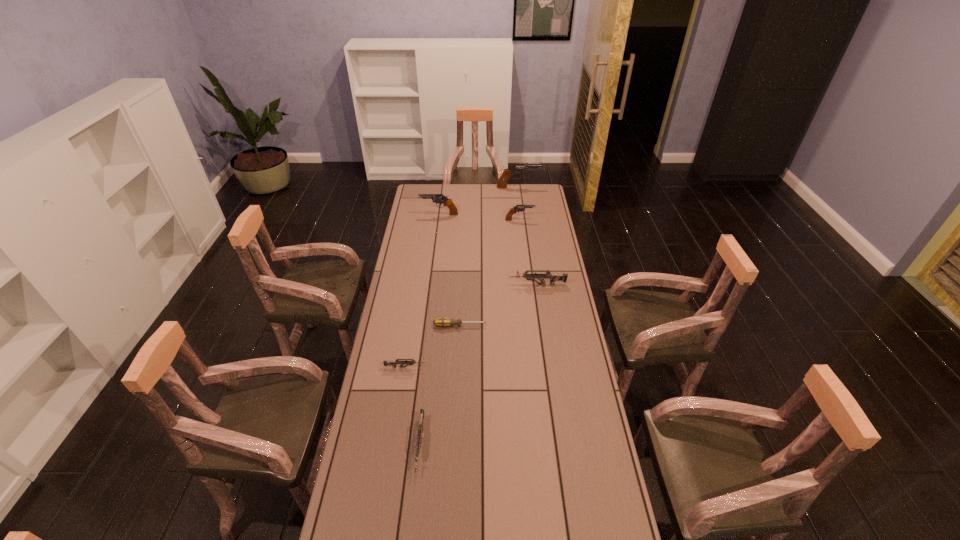
Find the location of a particular element. the shortest gun is located at coordinates (393, 363).

Locate an element on the screen. This screenshot has height=540, width=960. the sixth farthest object is located at coordinates (393, 363).

Locate an element on the screen. Image resolution: width=960 pixels, height=540 pixels. the third nearest object is located at coordinates (442, 322).

Locate an element on the screen. The width and height of the screenshot is (960, 540). screwdriver is located at coordinates (442, 322).

You are a GUI agent. You are given a task and a screenshot of the screen. Output one action in this format:
    pyautogui.click(x=<x>, y=<y>)
    Task: Click on the vacant space situated along the barrel of the fifth shortest gun
    The height and width of the screenshot is (540, 960).
    Given the screenshot: What is the action you would take?
    pyautogui.click(x=408, y=214)

Find the location of a particular element. The image size is (960, 540). vacant region located along the barrel of the fifth nearest object is located at coordinates (545, 220).

I want to click on vacant space located aimed along the barrel of the biggest grey gun, so click(492, 285).

The image size is (960, 540). What are the coordinates of `free spot located 0.170m aimed along the barrel of the biggest grey gun` in the screenshot? It's located at (472, 285).

The width and height of the screenshot is (960, 540). Find the location of `blank area located 0.130m aimed along the barrel of the biggest grey gun`. blank area located 0.130m aimed along the barrel of the biggest grey gun is located at coordinates (481, 285).

Find the location of a particular element. vacant space positioned 0.110m aimed along the barrel of the fifth tallest gun is located at coordinates (413, 515).